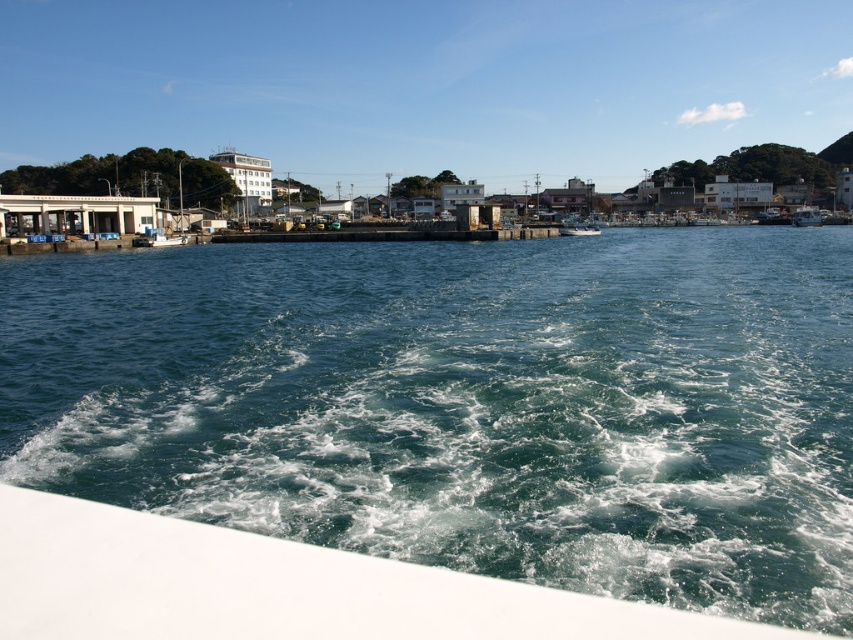
You are on a boat and looking at the scene. There is green water at center and a white plastic boat at right. Which object is lower in the image?

The green water at center is located below the white plastic boat at right, so it is lower in the image.

You are on a boat looking at the coastal scene. There are two points marked on your screen at coordinates point (380, 618) and point (792, 218). Which point is closer to you?

Point (380, 618) is closer to the camera than point (792, 218).